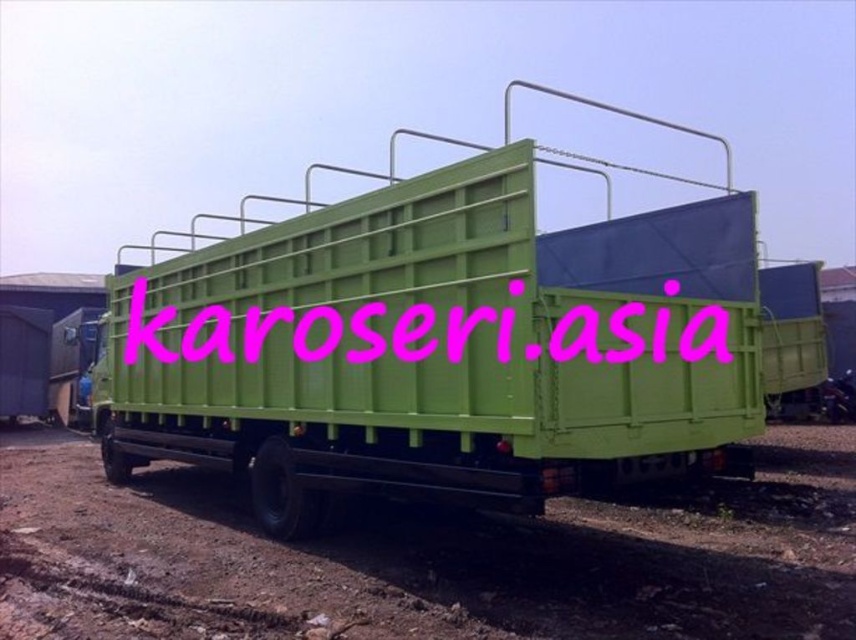
Question: Considering the relative positions of dirt track at lower center and pink matte text at center in the image provided, where is dirt track at lower center located with respect to pink matte text at center?

Choices:
 (A) above
 (B) below

Answer: (B)

Question: Estimate the real-world distances between objects in this image. Which object is closer to the green matte truck at center?

Choices:
 (A) pink matte text at center
 (B) dirt track at lower center

Answer: (B)

Question: Where is dirt track at lower center located in relation to pink matte text at center in the image?

Choices:
 (A) below
 (B) above

Answer: (A)

Question: Does green matte truck at center have a lesser width compared to pink matte text at center?

Choices:
 (A) yes
 (B) no

Answer: (B)

Question: Which point is closer to the camera taking this photo?

Choices:
 (A) (90, 554)
 (B) (152, 291)
 (C) (129, 298)

Answer: (A)

Question: Among these points, which one is farthest from the camera?

Choices:
 (A) (33, 448)
 (B) (316, 339)
 (C) (627, 321)

Answer: (A)